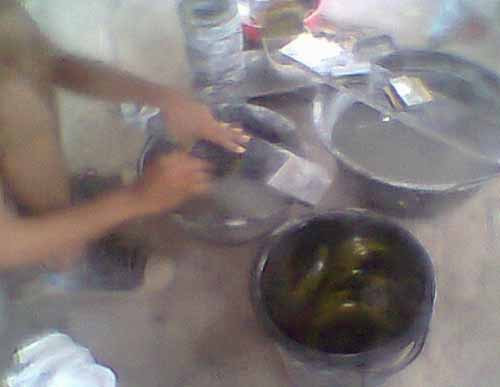
Where is `metal bowl`? The height and width of the screenshot is (387, 500). metal bowl is located at coordinates (402, 183), (223, 229).